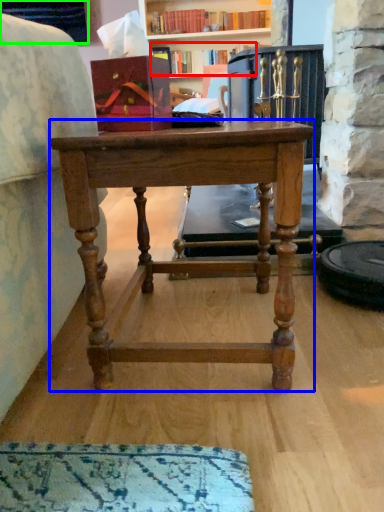
Question: Which object is the closest to the book (highlighted by a red box)? Choose among these: desk (highlighted by a blue box) or cabinetry (highlighted by a green box).

Choices:
 (A) desk
 (B) cabinetry

Answer: (B)